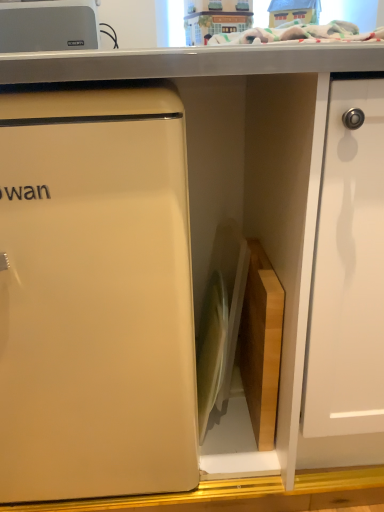
Question: Is silver metallic toaster at upper left, the 2th appliance positioned from the right, to the left or to the right of white glossy cutting board at center, acting as the first appliance starting from the right, in the image?

Choices:
 (A) right
 (B) left

Answer: (B)

Question: From the image's perspective, is silver metallic toaster at upper left, the first appliance in the left-to-right sequence, positioned above or below white glossy cutting board at center, which appears as the first appliance when ordered from the bottom?

Choices:
 (A) above
 (B) below

Answer: (A)

Question: Estimate the real-world distances between objects in this image. Which object is farther from the white glossy cutting board at center, the 2th appliance positioned from the top?

Choices:
 (A) matte plastic toy house at upper center
 (B) matte white refrigerator at left
 (C) silver metallic toaster at upper left, which ranks as the first appliance in top-to-bottom order

Answer: (C)

Question: Which of these objects is positioned closest to the silver metallic toaster at upper left, the 2th appliance positioned from the right?

Choices:
 (A) matte white refrigerator at left
 (B) matte plastic toy house at upper center
 (C) white glossy cutting board at center, which appears as the first appliance when ordered from the bottom

Answer: (B)